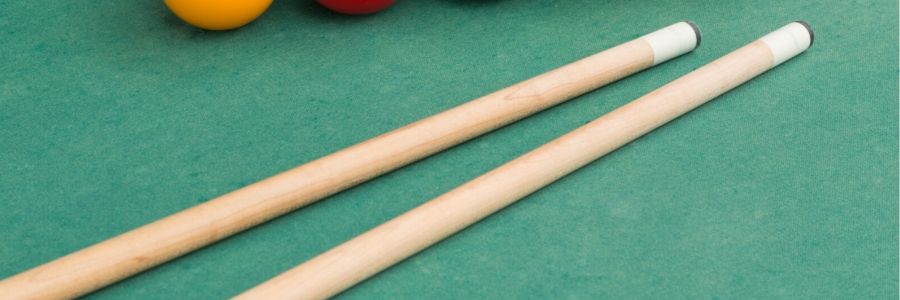
Locate an element on the screen. Image resolution: width=900 pixels, height=300 pixels. wooden pool cues is located at coordinates (270, 196), (376, 261).